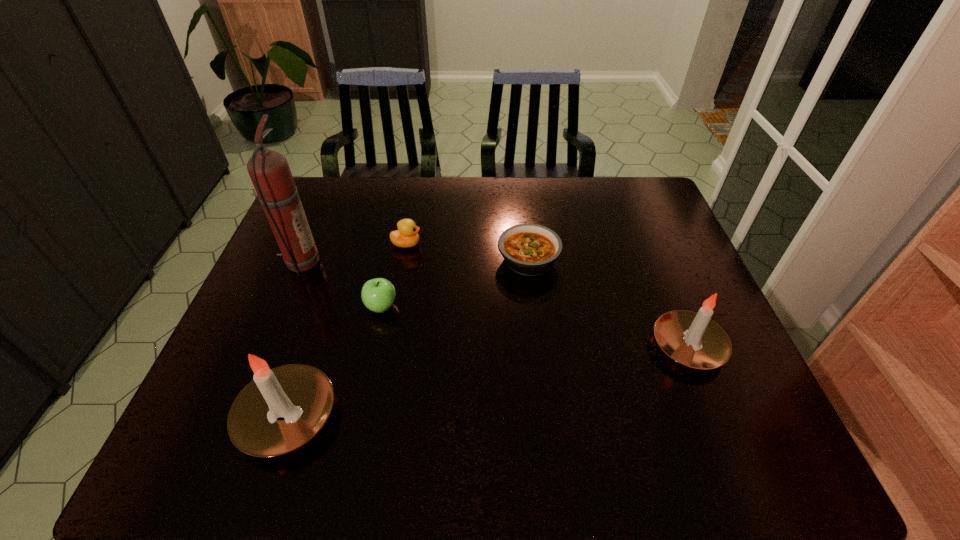
Find the location of a particular element. free spot between the apple and the rightmost object is located at coordinates (535, 326).

At what (x,y) coordinates should I click in order to perform the action: click on unoccupied area between the fifth shortest object and the fire extinguisher. Please return your answer as a coordinate pair (x, y). This screenshot has width=960, height=540. Looking at the image, I should click on (294, 340).

This screenshot has width=960, height=540. I want to click on unoccupied position between the second object from right to left and the duckling, so click(x=468, y=252).

In order to click on free space between the right candle and the tallest object in this screenshot , I will do `click(494, 305)`.

Identify the location of empty space that is in between the apple and the second object from right to left. The image size is (960, 540). (455, 283).

You are a GUI agent. You are given a task and a screenshot of the screen. Output one action in this format:
    pyautogui.click(x=<x>, y=<y>)
    Task: Click on the vacant area that lies between the tallest object and the second tallest object
    
    Given the screenshot: What is the action you would take?
    pyautogui.click(x=294, y=340)

This screenshot has width=960, height=540. Identify the location of object that stands as the second closest to the taller candle. (269, 171).

Where is `the closest object to the duckling`? This screenshot has width=960, height=540. the closest object to the duckling is located at coordinates (378, 294).

Locate an element on the screen. Image resolution: width=960 pixels, height=540 pixels. free space that satisfies the following two spatial constraints: 1. on the face of the duckling; 2. on the front side of the apple is located at coordinates (396, 307).

Where is `vacant area in the image that satisfies the following two spatial constraints: 1. on the back side of the stew; 2. on the right side of the taller candle`? vacant area in the image that satisfies the following two spatial constraints: 1. on the back side of the stew; 2. on the right side of the taller candle is located at coordinates (x=339, y=260).